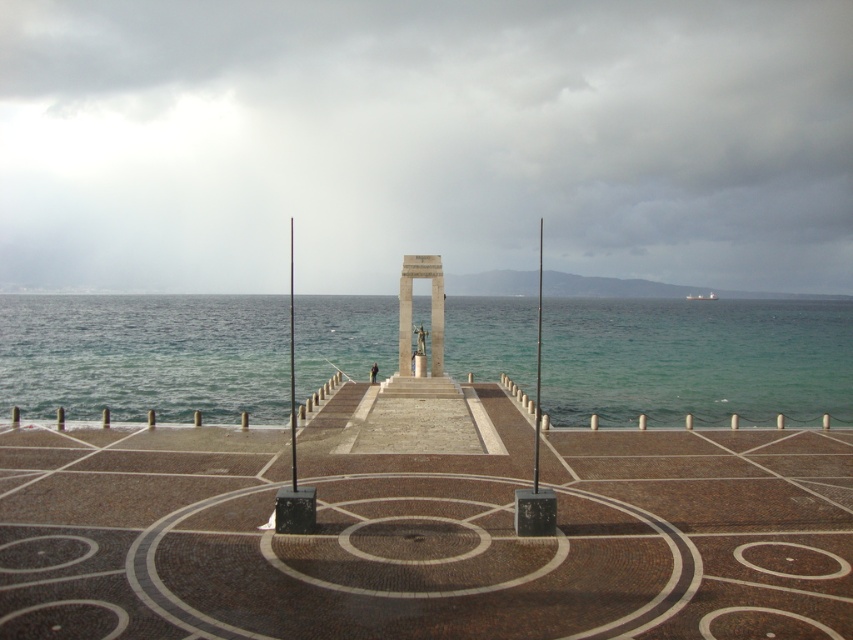
Question: Is brown mosaic dock at center positioned in front of clear blue water at center?

Choices:
 (A) yes
 (B) no

Answer: (A)

Question: Which point is farther to the camera?

Choices:
 (A) polished stone monument at center
 (B) clear blue water at center

Answer: (B)

Question: Can you confirm if brown mosaic dock at center is bigger than clear blue water at center?

Choices:
 (A) no
 (B) yes

Answer: (A)

Question: Among these objects, which one is nearest to the camera?

Choices:
 (A) polished stone monument at center
 (B) clear blue water at center
 (C) brown mosaic dock at center

Answer: (C)

Question: Does clear blue water at center have a larger size compared to polished stone monument at center?

Choices:
 (A) no
 (B) yes

Answer: (B)

Question: Which point is farther from the camera taking this photo?

Choices:
 (A) (247, 20)
 (B) (326, 616)
 (C) (579, 342)

Answer: (A)